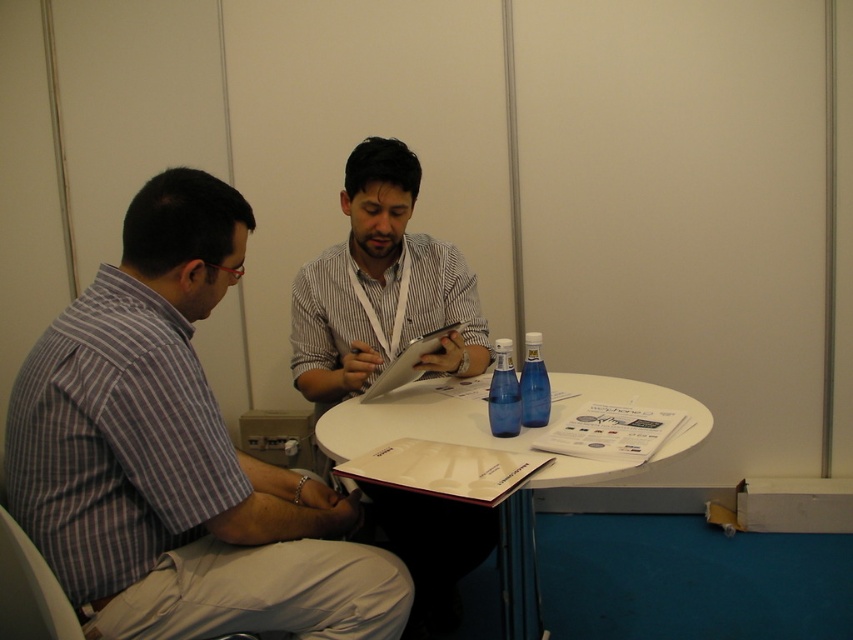
What are the coordinates of the matte striped shirt at center?

The coordinates of the matte striped shirt at center are at point (x=381, y=288).

You are a photographer at the event and need to take a photo of both the matte striped shirt at center and the white paper clipboard at center. Which object should you focus on first to ensure it is in the foreground?

The matte striped shirt at center has a greater height compared to the white paper clipboard at center, so you should focus on the matte striped shirt at center first to ensure it is in the foreground.

You are a person who wants to place a 10 inch ruler between the white paper clipboard at center and the blue glass bottle at center. Is there enough space to place it without moving either object?

The distance between the white paper clipboard at center and the blue glass bottle at center is 11.34 inches, so yes, there is enough space to place the 10 inch ruler between them without moving either object.